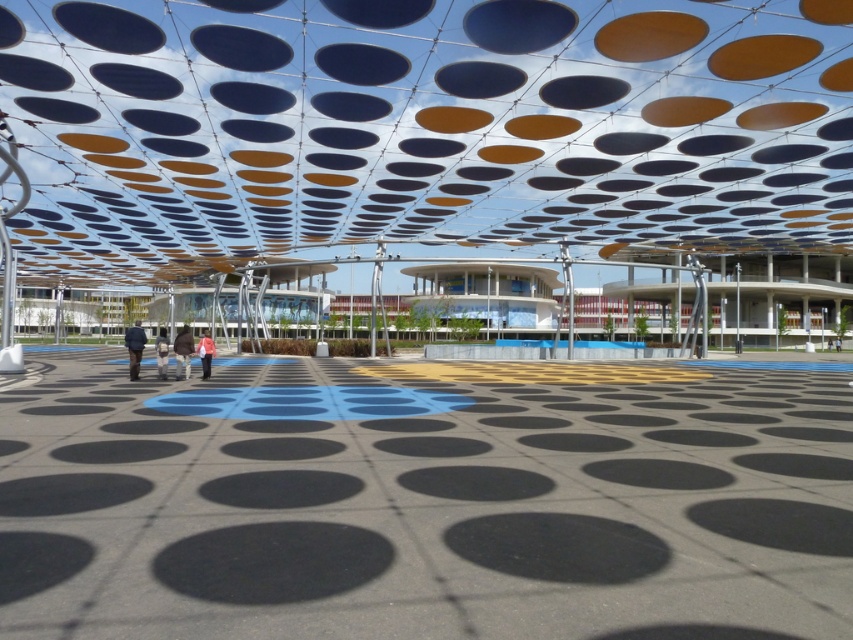
You are standing in the plaza and see both the dark brown leather jacket at center and the blue fabric jacket at center. Which jacket is closer to you?

The dark brown leather jacket at center is closer to you because the blue fabric jacket at center is positioned behind it.

Based on the photo, you are standing in the plaza and see two points marked on the ground. The first point is at coordinate point (186,355) and the second is at point (165,336). Which point is closer to you?

Point (186,355) is in front of point (165,336), so it is closer to you.